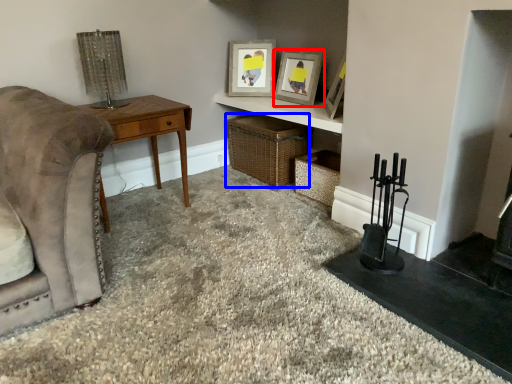
Question: Which object is closer to the camera taking this photo, picture frame (highlighted by a red box) or crate (highlighted by a blue box)?

Choices:
 (A) picture frame
 (B) crate

Answer: (A)